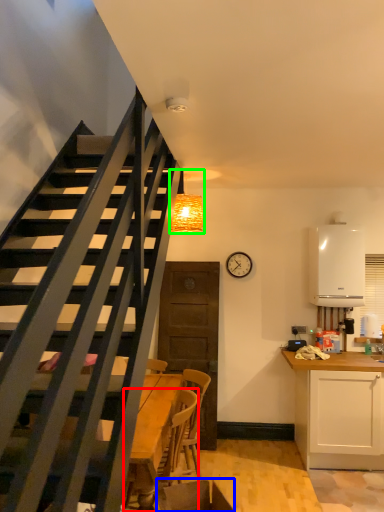
Question: Which object is the closest to the chair (highlighted by a red box)? Choose among these: swivel chair (highlighted by a blue box) or light fixture (highlighted by a green box).

Choices:
 (A) swivel chair
 (B) light fixture

Answer: (A)